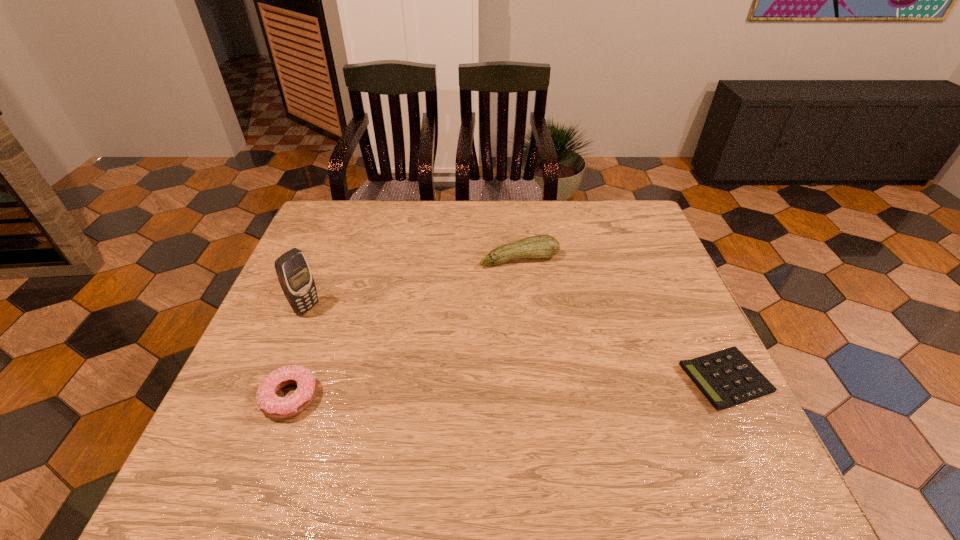
Where is `object at the near left corner`? object at the near left corner is located at coordinates (269, 403).

Image resolution: width=960 pixels, height=540 pixels. In order to click on object positioned at the near right corner in this screenshot , I will do `click(727, 378)`.

Locate an element on the screen. free space at the far edge of the desktop is located at coordinates (448, 210).

Where is `free space at the near edge of the desktop`? This screenshot has height=540, width=960. free space at the near edge of the desktop is located at coordinates (347, 416).

In the image, there is a desktop. Identify the location of vacant space at the left edge. The image size is (960, 540). (323, 312).

Locate an element on the screen. Image resolution: width=960 pixels, height=540 pixels. free space at the right edge is located at coordinates (656, 266).

The height and width of the screenshot is (540, 960). In the image, there is a desktop. Find the location of `vacant space at the far left corner`. vacant space at the far left corner is located at coordinates (320, 229).

At what (x,y) coordinates should I click in order to perform the action: click on free space at the far right corner. Please return your answer as a coordinate pair (x, y). Image resolution: width=960 pixels, height=540 pixels. Looking at the image, I should click on (635, 210).

Where is `vacant area between the rightmost object and the second farthest object`? Image resolution: width=960 pixels, height=540 pixels. vacant area between the rightmost object and the second farthest object is located at coordinates (516, 343).

I want to click on free space between the cellular telephone and the calculator, so click(x=516, y=343).